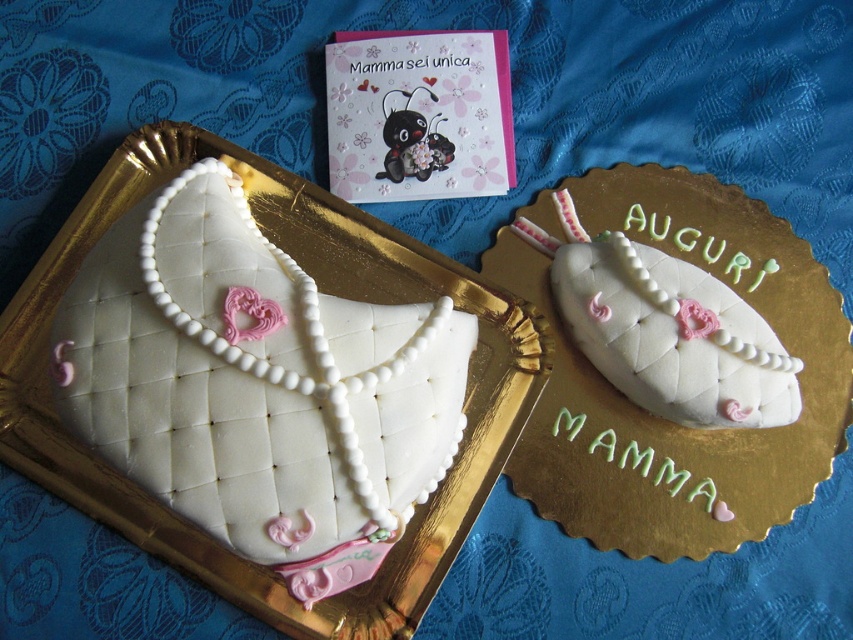
Who is positioned more to the left, white fondant purse at upper left or white fondant purse at upper center?

From the viewer's perspective, white fondant purse at upper left appears more on the left side.

Is white fondant purse at upper left above white fondant purse at upper center?

No, white fondant purse at upper left is not above white fondant purse at upper center.

Does point (154, 209) come behind point (695, 364)?

No, it is in front of (695, 364).

Where is `white fondant purse at upper left`? white fondant purse at upper left is located at coordinates (259, 387).